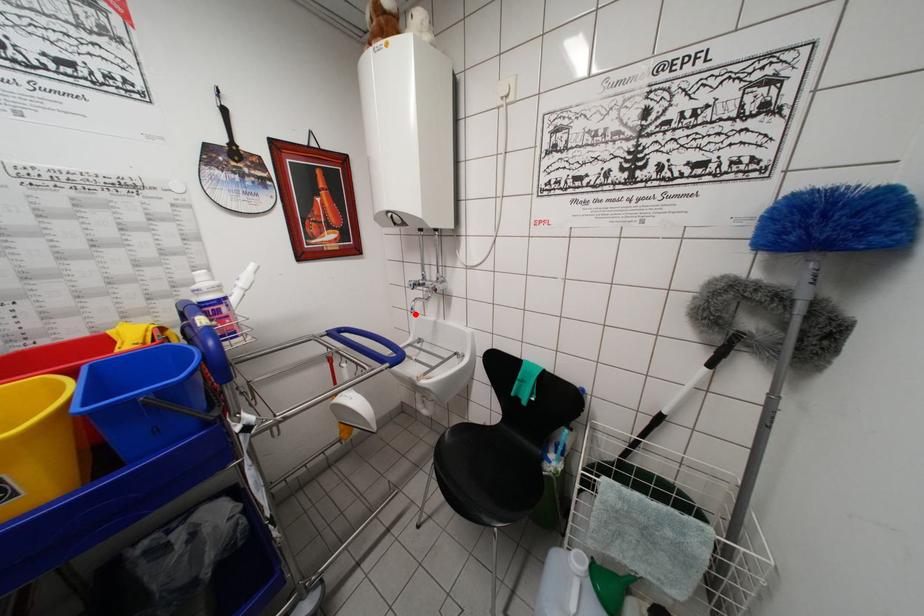
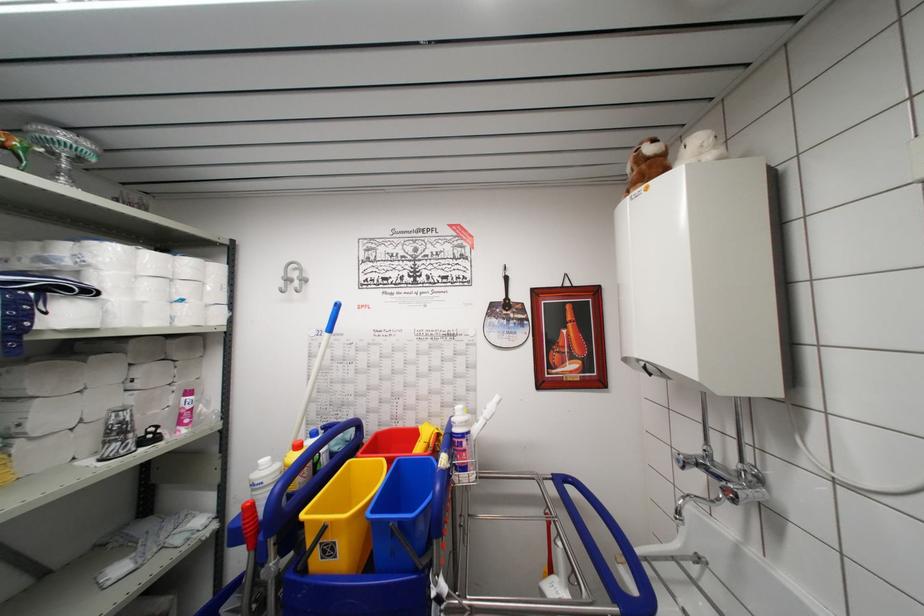
Question: I am providing you with two images of the same scene from different viewpoints. Image1 has a red point marked. In image2, the corresponding 3D location appears at what relative position? Reply with the corresponding letter.

Choices:
 (A) Closer
 (B) Farther

Answer: (B)